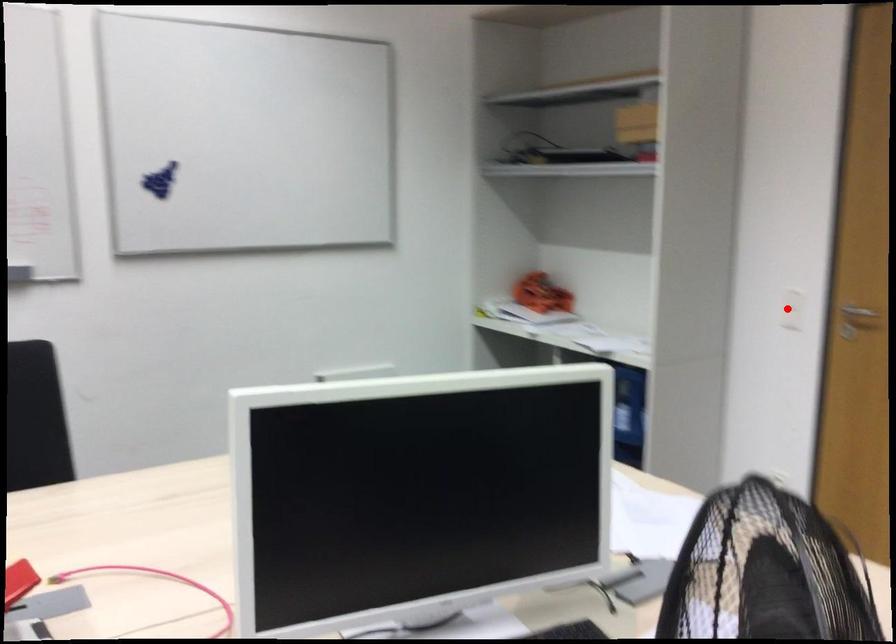
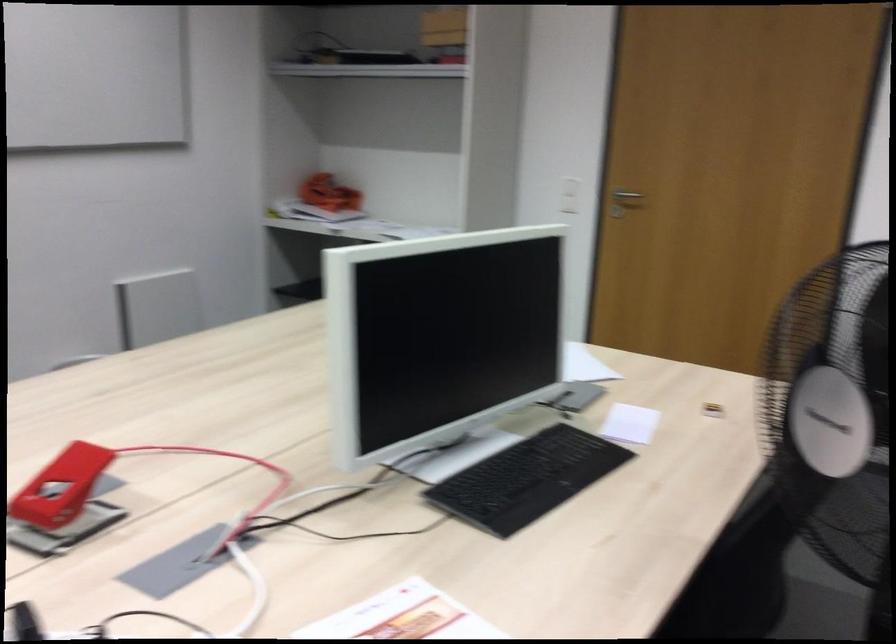
Question: A red point is marked in image1. In image2, is the corresponding 3D point closer to the camera or farther? Reply with the corresponding letter.

Choices:
 (A) The corresponding 3D point is closer.
 (B) The corresponding 3D point is farther.

Answer: (B)